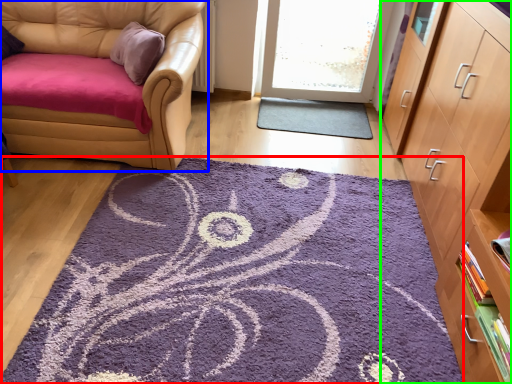
Question: Which object is positioned farthest from mat (highlighted by a red box)? Select from chair (highlighted by a blue box) and cabinetry (highlighted by a green box).

Choices:
 (A) chair
 (B) cabinetry

Answer: (A)